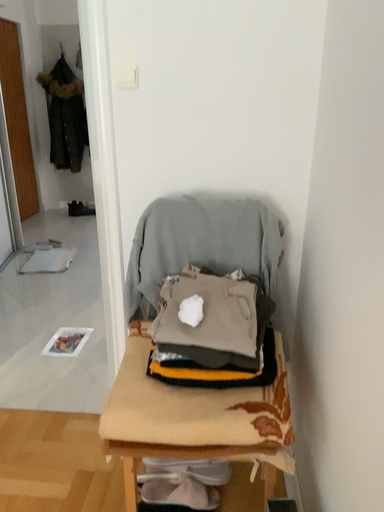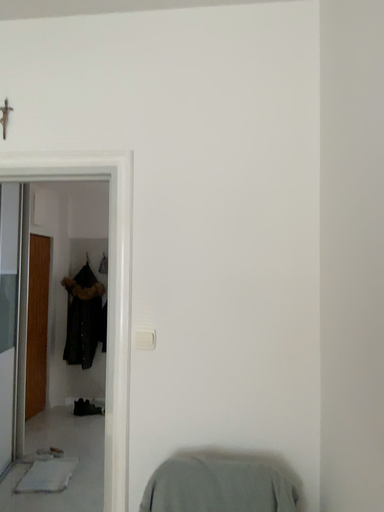
Question: Which way did the camera rotate in the video?

Choices:
 (A) rotated downward
 (B) rotated upward

Answer: (B)